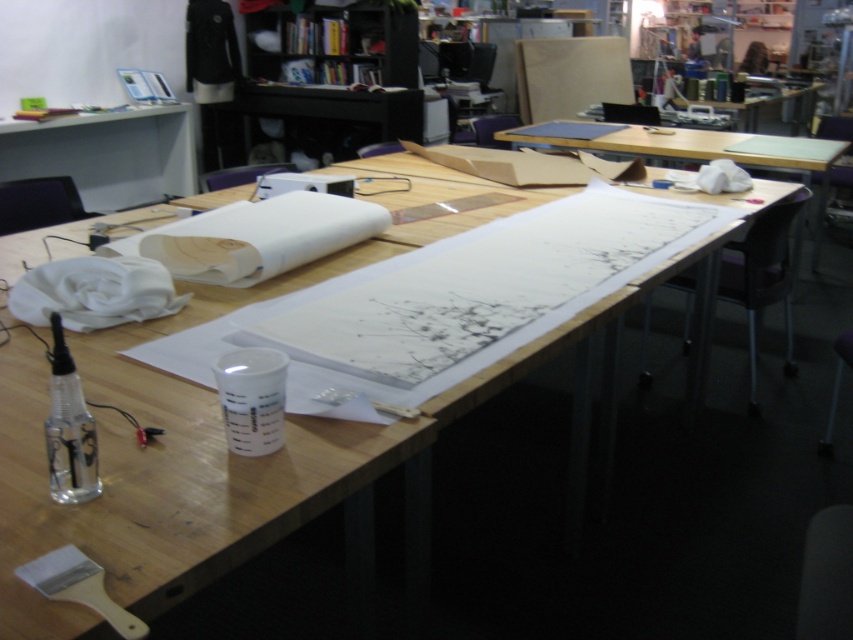
You are organizing a workspace and need to place a large art project. Which object, the wooden table at center or the matte white desk at upper left, can accommodate the project based on their sizes?

The wooden table at center is bigger than the matte white desk at upper left, so it can accommodate the large art project.

You are standing in front of the workspace and want to place a 24 inch ruler on the wooden table at center. Can you reach the table without moving closer than your current position?

The wooden table at center is 30.52 inches away from you. Since the ruler is 24 inches long, you can comfortably reach and place it on the table without needing to move closer than your current position.

You are standing at the edge of the table looking at the workspace. There are two points marked on the table, point (10,408) and point (764,148). Which point is closer to you?

Point (10,408) is in front of point (764,148), so it is closer to you.